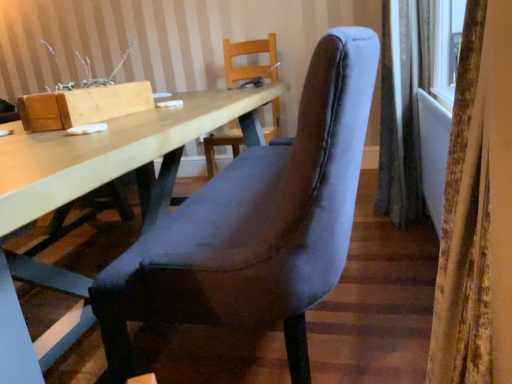
Question: Is gray fabric curtain at right, the 1th curtain from the back, directly adjacent to velvet grey chair at center?

Choices:
 (A) no
 (B) yes

Answer: (A)

Question: Is gray fabric curtain at right, the second curtain from the front, positioned in front of velvet grey chair at center?

Choices:
 (A) no
 (B) yes

Answer: (A)

Question: Does gray fabric curtain at right, the 1th curtain from the back, have a smaller size compared to velvet grey chair at center?

Choices:
 (A) no
 (B) yes

Answer: (B)

Question: Can we say gray fabric curtain at right, which ranks as the 2th curtain in left-to-right order, lies outside velvet grey chair at center?

Choices:
 (A) no
 (B) yes

Answer: (B)

Question: Is gray fabric curtain at right, the 1th curtain from the back, taller than velvet grey chair at center?

Choices:
 (A) no
 (B) yes

Answer: (B)

Question: Considering the relative sizes of gray fabric curtain at right, which ranks as the 2th curtain in left-to-right order, and velvet grey chair at center in the image provided, is gray fabric curtain at right, which ranks as the 2th curtain in left-to-right order, thinner than velvet grey chair at center?

Choices:
 (A) yes
 (B) no

Answer: (A)

Question: From the image's perspective, is velvet curtain at right, which is the 1th curtain from left to right, under gray fabric curtain at right, which ranks as the 2th curtain in left-to-right order?

Choices:
 (A) no
 (B) yes

Answer: (B)

Question: Is velvet curtain at right, positioned as the 2th curtain in back-to-front order, turned away from gray fabric curtain at right, the second curtain from the front?

Choices:
 (A) no
 (B) yes

Answer: (A)

Question: Could you tell me if velvet curtain at right, positioned as the 2th curtain in back-to-front order, is turned towards gray fabric curtain at right, arranged as the first curtain when viewed from the right?

Choices:
 (A) no
 (B) yes

Answer: (A)

Question: Is velvet curtain at right, the 1th curtain viewed from the front, to the left of gray fabric curtain at right, the second curtain from the front, from the viewer's perspective?

Choices:
 (A) no
 (B) yes

Answer: (B)

Question: From the image's perspective, is velvet curtain at right, which is the 1th curtain from left to right, on gray fabric curtain at right, which ranks as the 2th curtain in left-to-right order?

Choices:
 (A) no
 (B) yes

Answer: (A)

Question: Does velvet curtain at right, which is the 1th curtain from left to right, have a smaller size compared to gray fabric curtain at right, the 1th curtain from the back?

Choices:
 (A) no
 (B) yes

Answer: (B)

Question: Is gray fabric curtain at right, the second curtain from the front, to the left of velvet curtain at right, which is the 1th curtain from left to right, from the viewer's perspective?

Choices:
 (A) no
 (B) yes

Answer: (A)